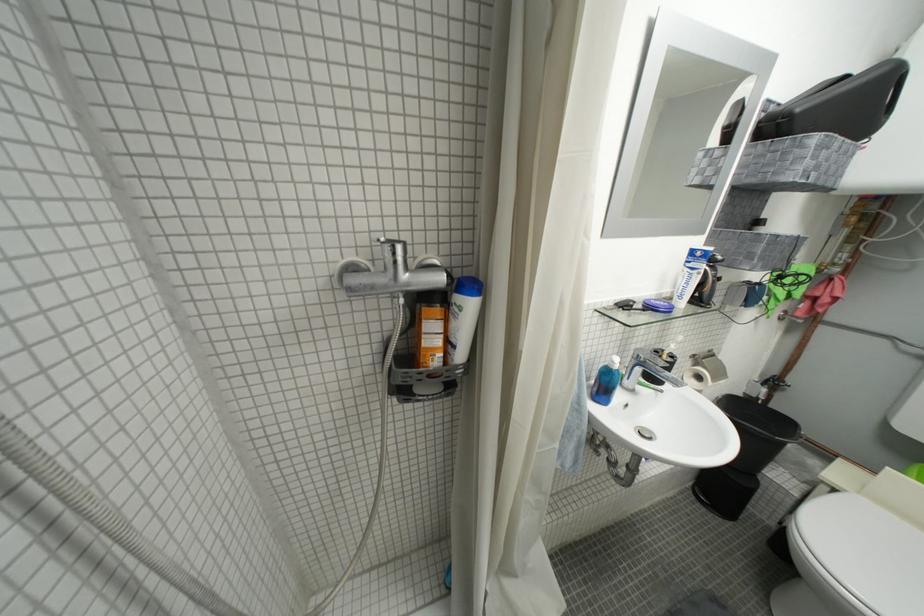
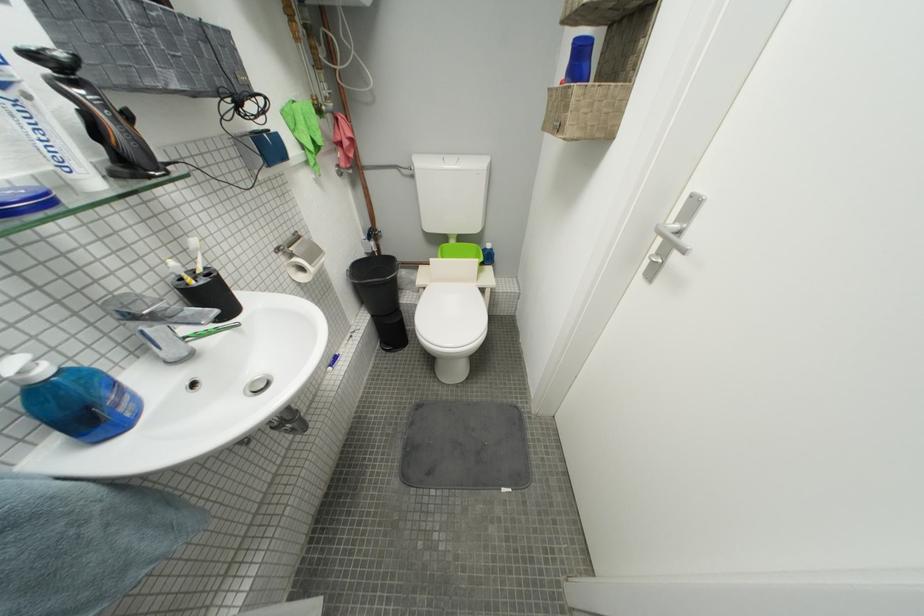
From the picture: How did the camera likely rotate?

The rotation direction of the camera is right-down.